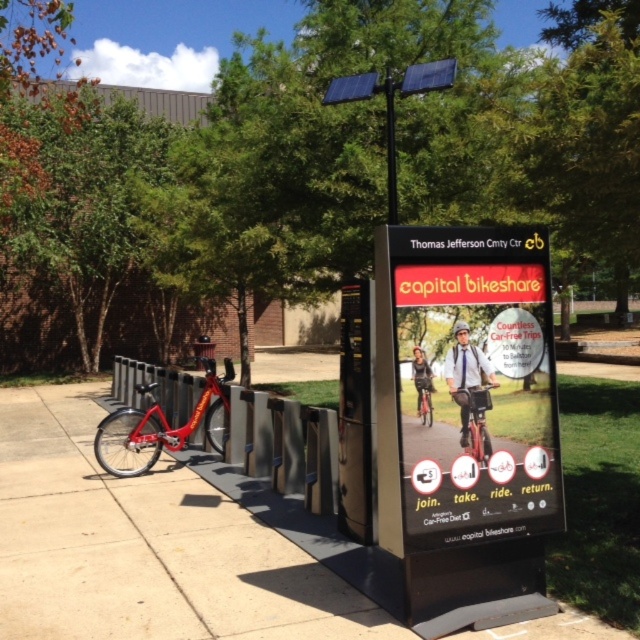
Is concrete sidewalk at center shorter than red matte bicycle at center?

Correct, concrete sidewalk at center is not as tall as red matte bicycle at center.

Based on the photo, which of these two, concrete sidewalk at center or red matte bicycle at center, stands taller?

red matte bicycle at center

Find the location of a particular element. concrete sidewalk at center is located at coordinates (145, 545).

Looking at this image, can you confirm if metallic sign at center is thinner than red matte bicycle at center?

No.

Who is shorter, metallic sign at center or red matte bicycle at center?

red matte bicycle at center is shorter.

What do you see at coordinates (467, 422) in the screenshot? This screenshot has width=640, height=640. I see `metallic sign at center` at bounding box center [467, 422].

The width and height of the screenshot is (640, 640). In order to click on metallic sign at center in this screenshot , I will do `click(467, 422)`.

Which is below, metallic red bike at left or red matte bicycle at center?

Positioned lower is metallic red bike at left.

Which is above, metallic red bike at left or red matte bicycle at center?

red matte bicycle at center is higher up.

Locate an element on the screen. Image resolution: width=640 pixels, height=640 pixels. metallic red bike at left is located at coordinates (161, 426).